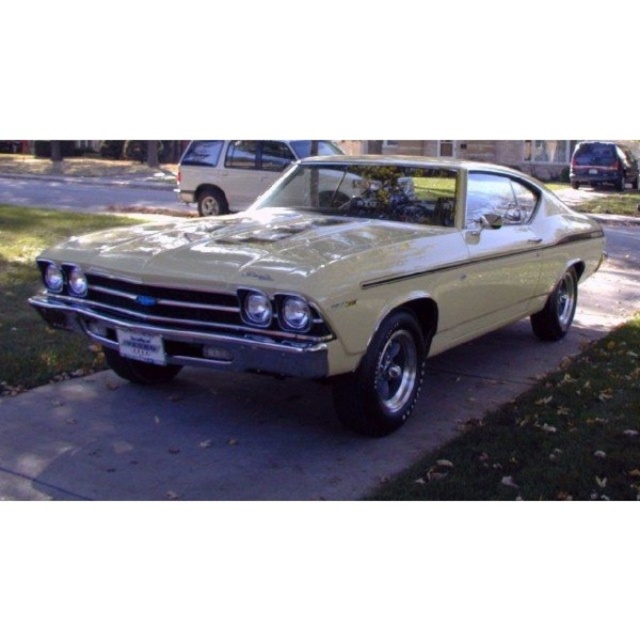
Between point (88, 330) and point (577, 180), which one is positioned behind?

The point (577, 180) is behind.

Is point (556, 314) farther from camera compared to point (595, 180)?

No, (556, 314) is closer to viewer.

The image size is (640, 640). Describe the element at coordinates (332, 276) in the screenshot. I see `matte gold car at center` at that location.

Where is `matte gold car at center`? This screenshot has height=640, width=640. matte gold car at center is located at coordinates (332, 276).

Can you confirm if matte gold car at center is bigger than metallic gold car at center?

Indeed, matte gold car at center has a larger size compared to metallic gold car at center.

Who is taller, matte gold car at center or metallic gold car at center?

matte gold car at center is taller.

Does point (176, 272) lie behind point (237, 209)?

No, (176, 272) is in front of (237, 209).

Where is `matte gold car at center`? matte gold car at center is located at coordinates (332, 276).

Identify the location of matte black minivan at center. The width and height of the screenshot is (640, 640). (602, 164).

From the picture: Is matte black minivan at center shorter than white plastic license plate at center?

No, matte black minivan at center is not shorter than white plastic license plate at center.

Who is more distant from viewer, (605, 156) or (138, 339)?

The point (605, 156) is behind.

At what (x,y) coordinates should I click in order to perform the action: click on matte black minivan at center. Please return your answer as a coordinate pair (x, y). This screenshot has width=640, height=640. Looking at the image, I should click on (602, 164).